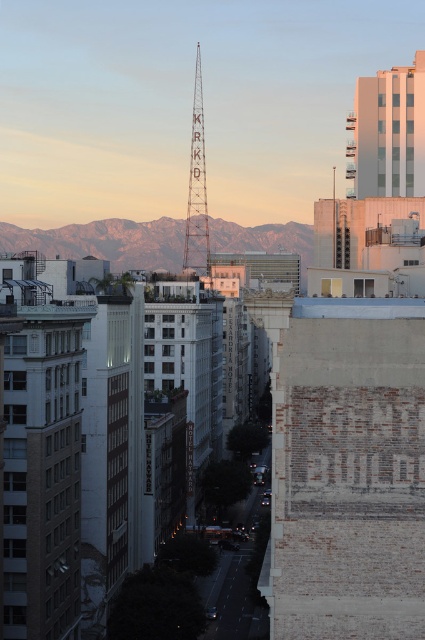
You are a drone operator trying to navigate between the gray rocky mountains at center and the white concrete building at upper right. Which object is positioned higher in the image?

The white concrete building at upper right is positioned higher than the gray rocky mountains at center in the image.

Looking at this image, you are standing on the street in the image and want to take a photo of the white concrete building at upper right. Considering the distance, what is the minimum focal length lens you should use to capture the entire building in one frame?

To capture the entire white concrete building at upper right in one frame, you need a wide angle lens. Since the distance is 164.90 meters, a wide angle lens with a focal length of 35mm or lower would be appropriate.